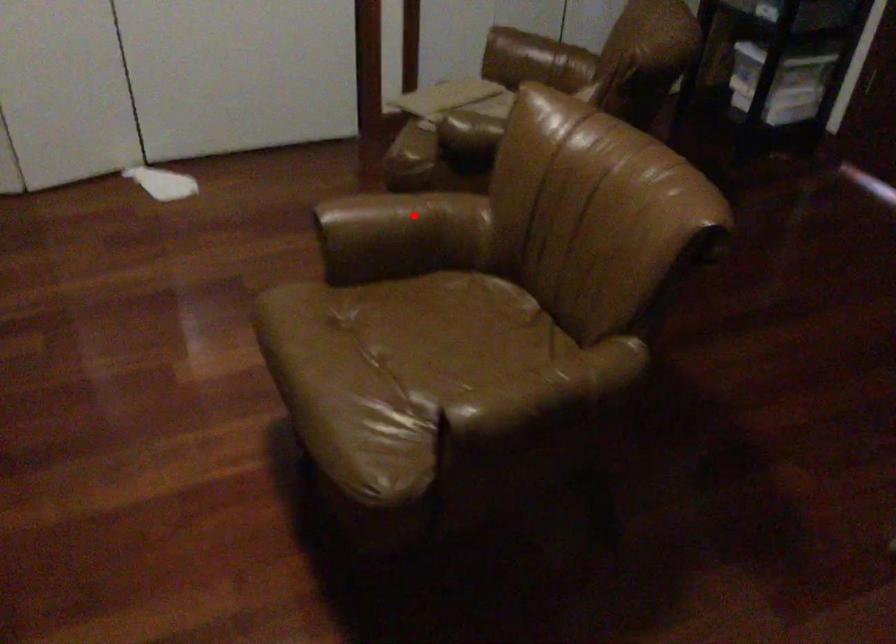
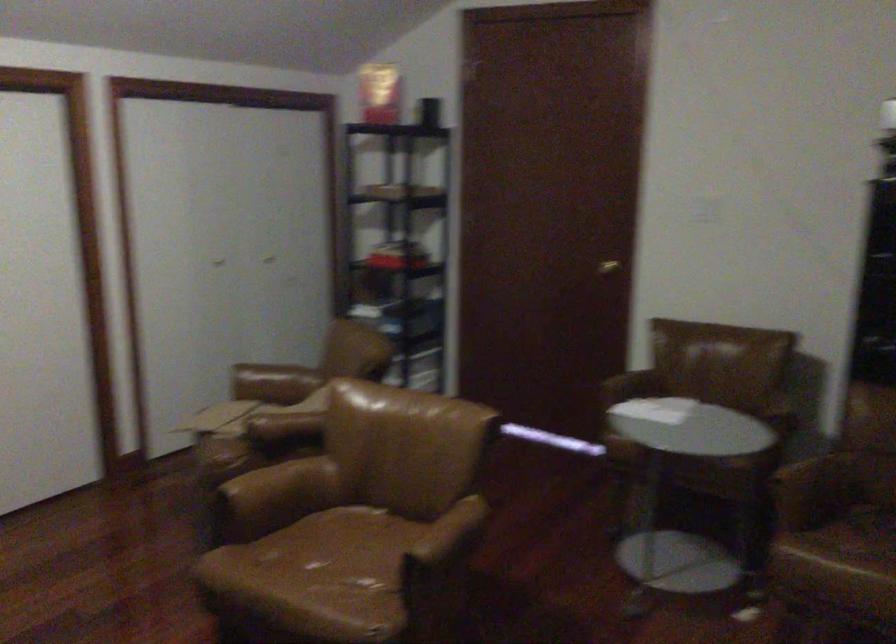
Locate, in the second image, the point that corresponds to the highlighted location in the first image.

(280, 484)